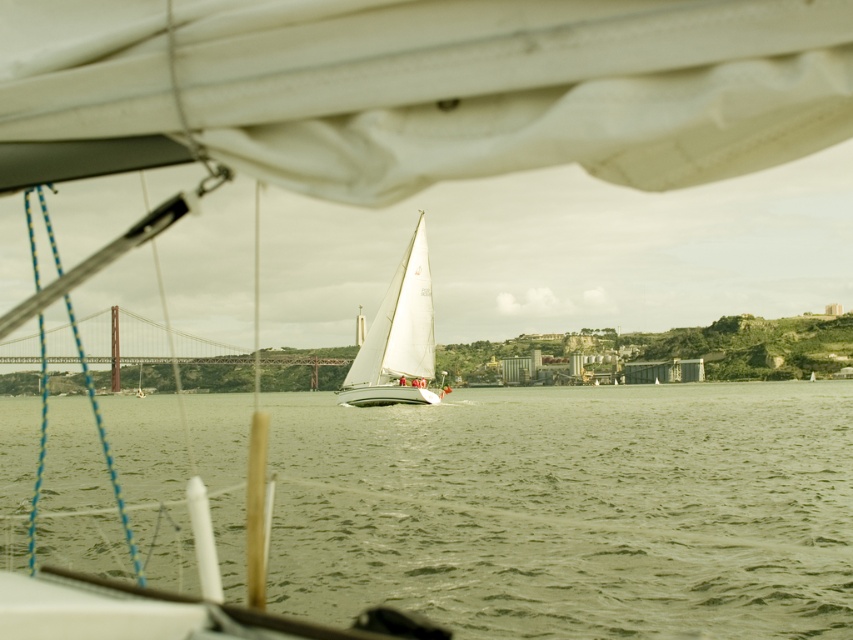
Question: Can you confirm if white matte sailboat at center is positioned above metallic bridge at left?

Choices:
 (A) no
 (B) yes

Answer: (B)

Question: Estimate the real-world distances between objects in this image. Which object is closer to the green water at center?

Choices:
 (A) metallic bridge at left
 (B) white matte sailboat at center

Answer: (B)

Question: From the image, what is the correct spatial relationship of green water at center in relation to metallic bridge at left?

Choices:
 (A) right
 (B) left

Answer: (A)

Question: Which point is farther to the camera?

Choices:
 (A) green water at center
 (B) white matte sailboat at center
 (C) metallic bridge at left

Answer: (C)

Question: Among these objects, which one is nearest to the camera?

Choices:
 (A) white matte sailboat at center
 (B) metallic bridge at left

Answer: (A)

Question: Observing the image, what is the correct spatial positioning of green water at center in reference to white matte sailboat at center?

Choices:
 (A) right
 (B) left

Answer: (B)